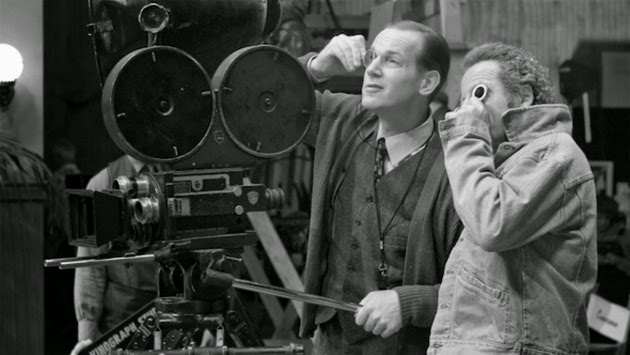
At what (x,y) coordinates should I click in order to perform the action: click on light. Please return your answer as a coordinate pair (x, y). This screenshot has width=630, height=355. Looking at the image, I should click on (9, 67).